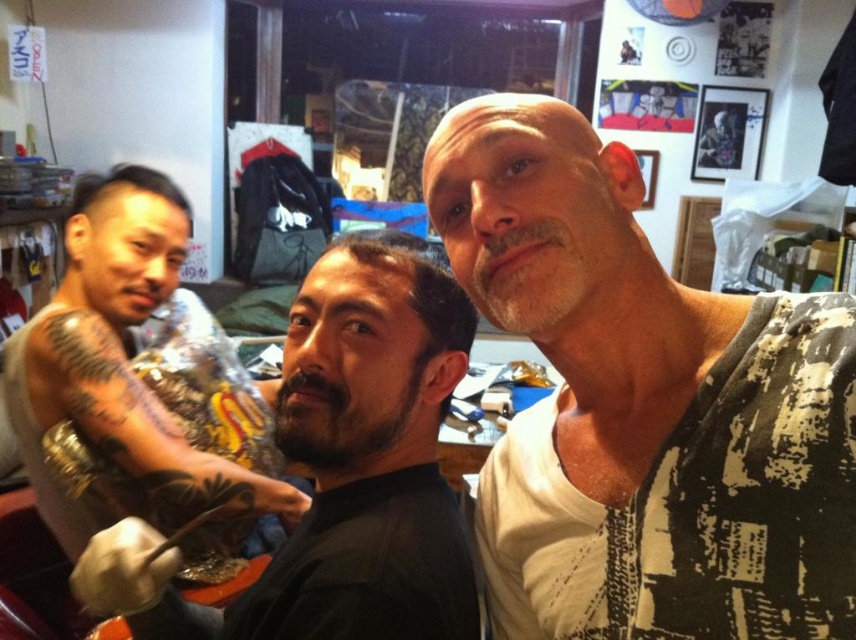
Question: Is black matte shirt at center bigger than dark brown hair at left?

Choices:
 (A) no
 (B) yes

Answer: (B)

Question: Which point appears closest to the camera in this image?

Choices:
 (A) (64, 428)
 (B) (308, 412)

Answer: (B)

Question: Does black matte shirt at center appear on the left side of black tattooed arm at left?

Choices:
 (A) no
 (B) yes

Answer: (A)

Question: Estimate the real-world distances between objects in this image. Which object is farther from the dark brown hair at center?

Choices:
 (A) dark skin tattooed arm at left
 (B) black matte shirt at center
 (C) dark brown hair at left
 (D) white textured shirt at upper right

Answer: (C)

Question: Estimate the real-world distances between objects in this image. Which object is closer to the dark brown hair at center?

Choices:
 (A) white textured shirt at upper right
 (B) black tattooed arm at left
 (C) black matte shirt at center
 (D) dark skin tattooed arm at left

Answer: (C)

Question: Observing the image, what is the correct spatial positioning of dark skin tattooed arm at left in reference to dark brown hair at center?

Choices:
 (A) right
 (B) left

Answer: (B)